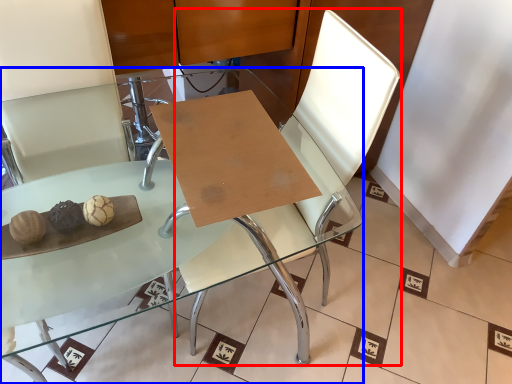
Question: Which object appears closest to the camera in this image, swivel chair (highlighted by a red box) or table (highlighted by a blue box)?

Choices:
 (A) swivel chair
 (B) table

Answer: (B)